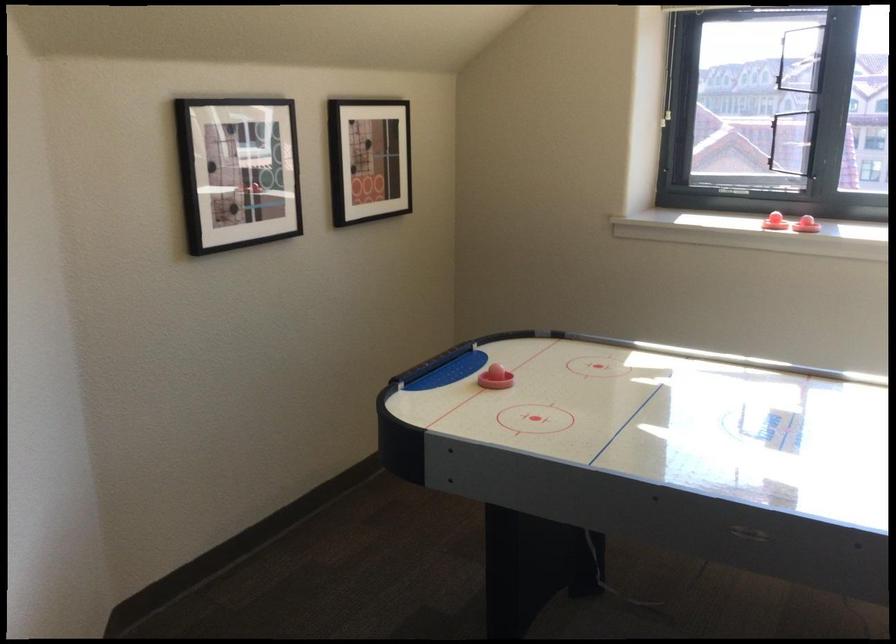
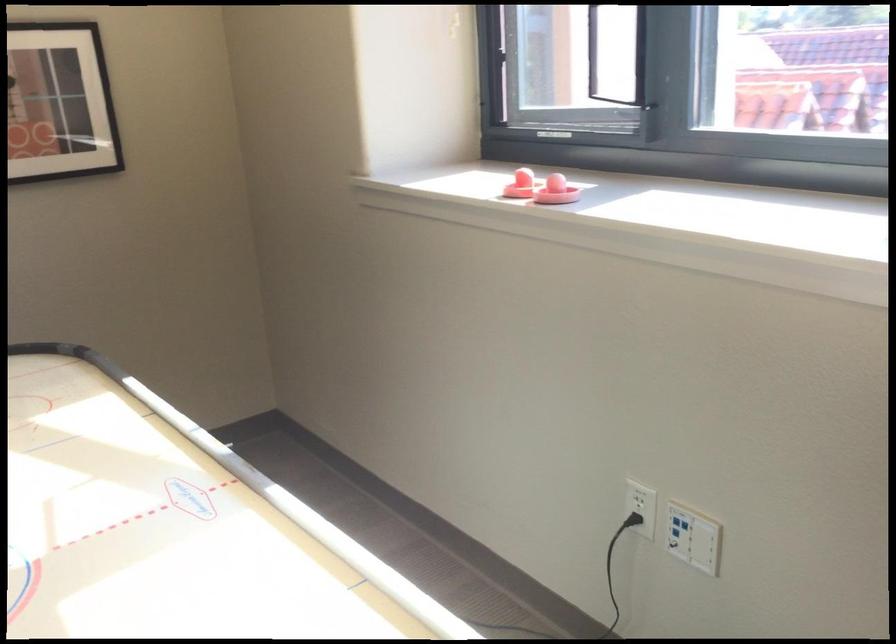
The images are taken continuously from a first-person perspective. In which direction are you moving?

The cameraman walked toward right, forward.